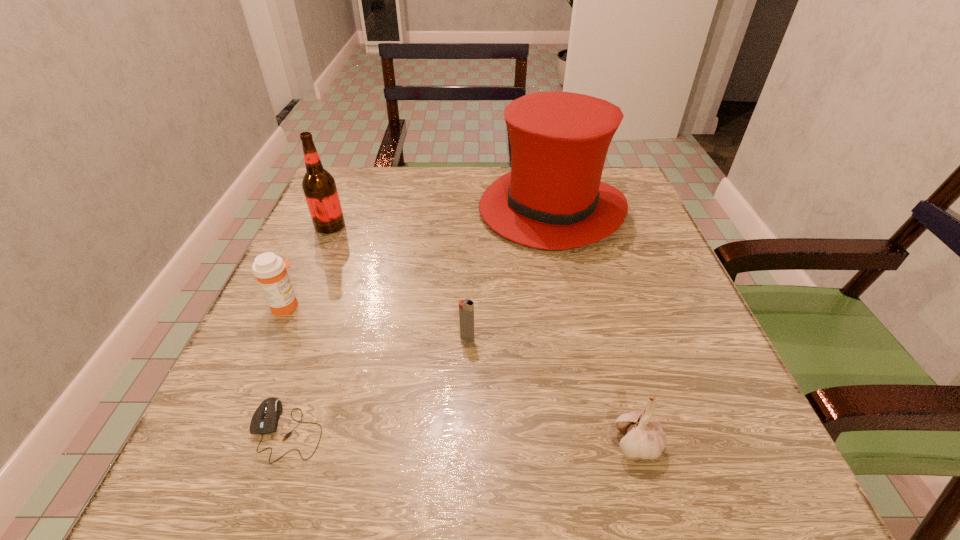
I want to click on vacant region located on the right of the fourth nearest object, so click(482, 306).

Locate an element on the screen. free location located on the left of the igniter is located at coordinates (337, 339).

Locate an element on the screen. The image size is (960, 540). vacant area situated on the back of the garlic is located at coordinates (585, 255).

Where is `vacant space located 0.310m on the right of the computer mouse`? The height and width of the screenshot is (540, 960). vacant space located 0.310m on the right of the computer mouse is located at coordinates (540, 430).

What are the coordinates of `hat that is at the far edge` in the screenshot? It's located at (553, 198).

At what (x,y) coordinates should I click in order to perform the action: click on root beer present at the far edge. Please return your answer as a coordinate pair (x, y). Image resolution: width=960 pixels, height=540 pixels. Looking at the image, I should click on (319, 187).

Image resolution: width=960 pixels, height=540 pixels. In order to click on garlic present at the near edge in this screenshot , I will do `click(644, 438)`.

Find the location of a particular element. The height and width of the screenshot is (540, 960). computer mouse present at the near edge is located at coordinates (265, 419).

Find the location of `root beer present at the left edge`. root beer present at the left edge is located at coordinates (319, 187).

Where is `medicine that is positioned at the left edge`? medicine that is positioned at the left edge is located at coordinates (270, 270).